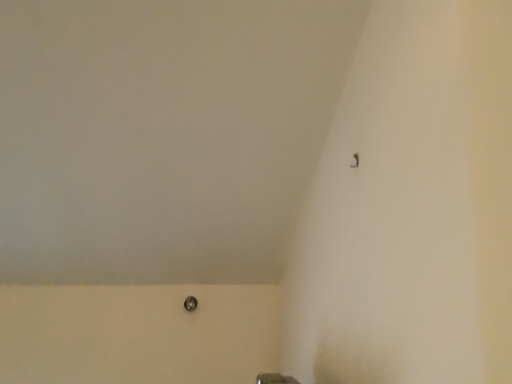
Measure the distance between point (188,308) and camera.

Point (188,308) is 1.35 meters away from camera.

What do you see at coordinates (190, 303) in the screenshot?
I see `metallic silver door handle at lower center` at bounding box center [190, 303].

In order to click on metallic silver door handle at lower center in this screenshot , I will do `click(190, 303)`.

Image resolution: width=512 pixels, height=384 pixels. Identify the location of metallic silver door handle at lower center. (190, 303).